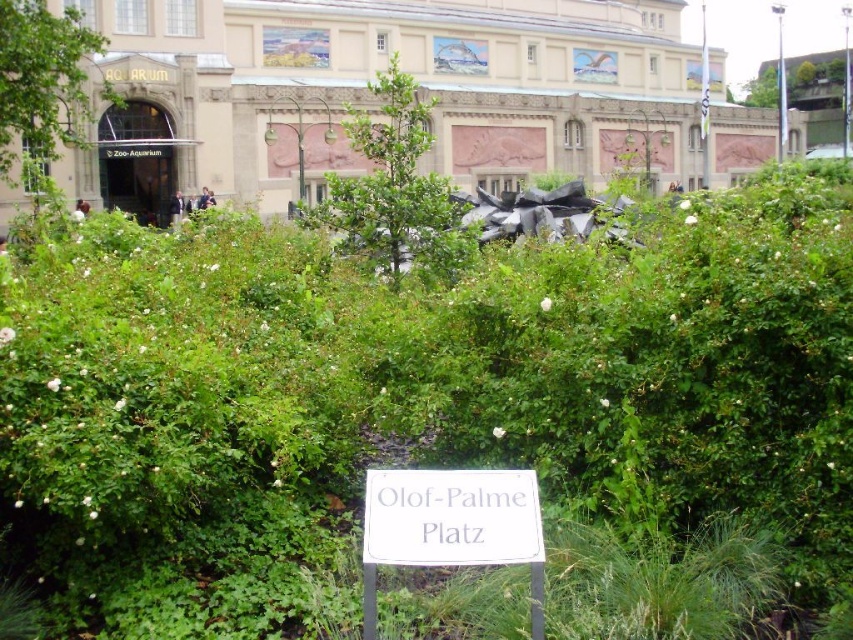
Does green leafy bush at center have a larger size compared to white plastic sign at center?

Yes.

Can you confirm if green leafy bush at center is thinner than white plastic sign at center?

No.

I want to click on green leafy bush at center, so click(x=395, y=189).

Find the location of a particular element. green leafy bush at center is located at coordinates (395, 189).